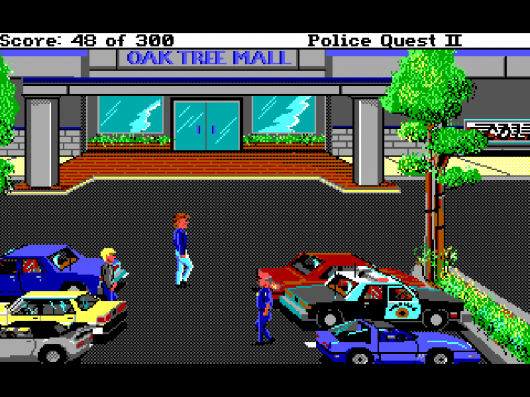
Locate an element on the screen. The image size is (530, 397). plants below window is located at coordinates (292, 136), (125, 136).